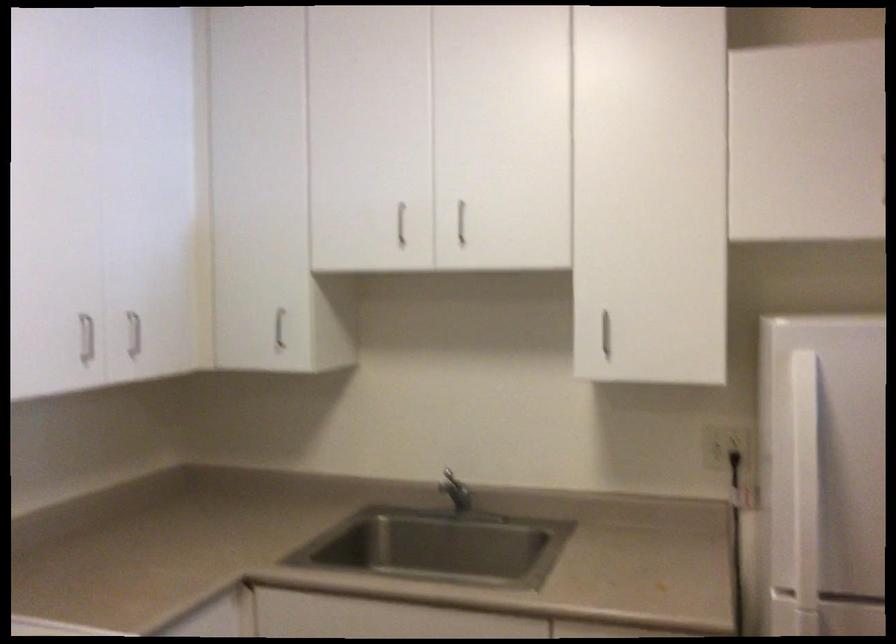
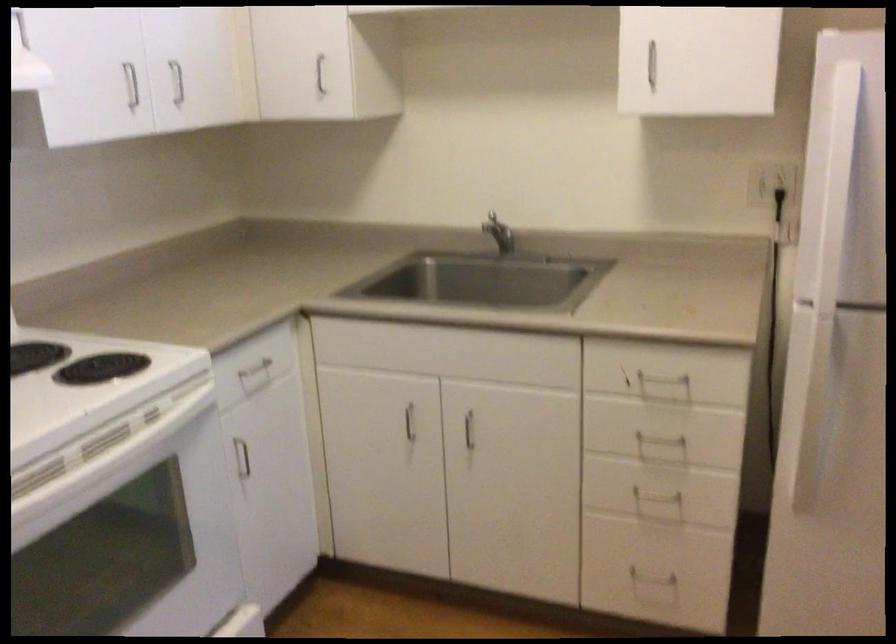
Where in the second image is the point corresponding to point 810,538 from the first image?

(831, 240)